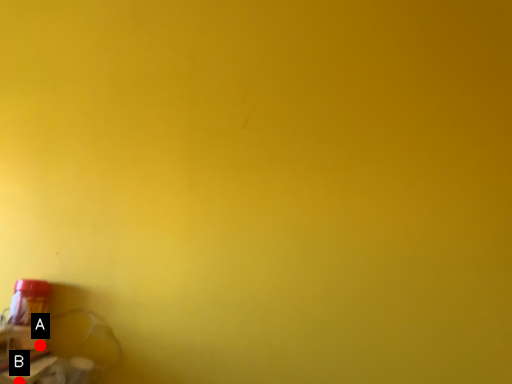
Question: Two points are circled on the image, labeled by A and B beside each circle. Among these points, which one is nearest to the camera?

Choices:
 (A) A is closer
 (B) B is closer

Answer: (B)